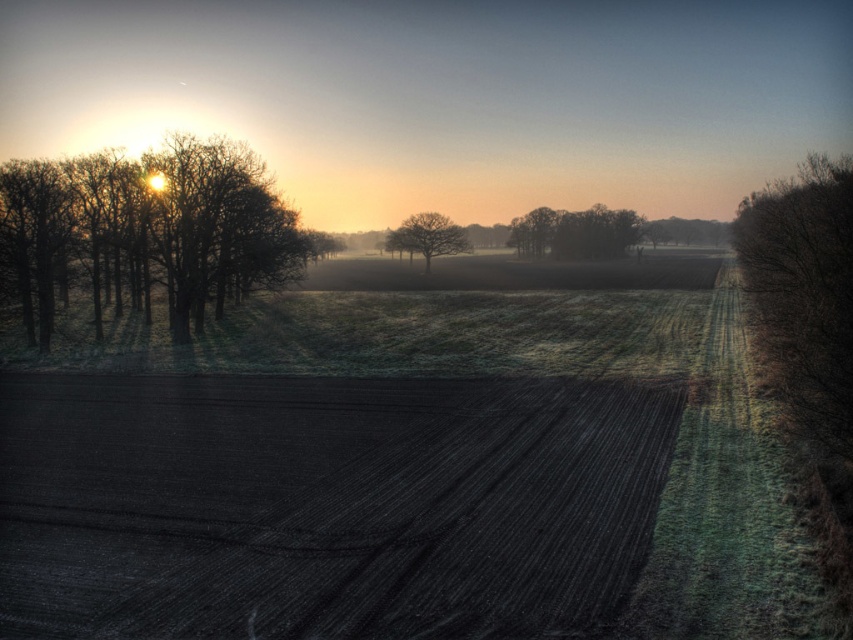
Which is below, dark green textured trees at center or smooth brown tree at center?

Positioned lower is smooth brown tree at center.

Does dark green textured trees at center have a larger size compared to smooth brown tree at center?

Correct, dark green textured trees at center is larger in size than smooth brown tree at center.

Where is `dark green textured trees at center`? dark green textured trees at center is located at coordinates (575, 232).

Who is more distant from viewer, (120, 205) or (447, 237)?

Point (447, 237)

Where is `brown matte trees at left`? Image resolution: width=853 pixels, height=640 pixels. brown matte trees at left is located at coordinates (144, 230).

Where is `brown matte trees at left`? The height and width of the screenshot is (640, 853). brown matte trees at left is located at coordinates (144, 230).

In the scene shown: Does brown matte tree at right appear on the right side of smooth brown tree at center?

Correct, you'll find brown matte tree at right to the right of smooth brown tree at center.

Is point (805, 177) positioned after point (387, 236)?

That is False.

Does point (775, 269) come closer to viewer compared to point (437, 225)?

Yes, it is in front of point (437, 225).

You are a GUI agent. You are given a task and a screenshot of the screen. Output one action in this format:
    pyautogui.click(x=<x>, y=<y>)
    Task: Click on the brown matte tree at right
    The height and width of the screenshot is (640, 853).
    Given the screenshot: What is the action you would take?
    pyautogui.click(x=804, y=296)